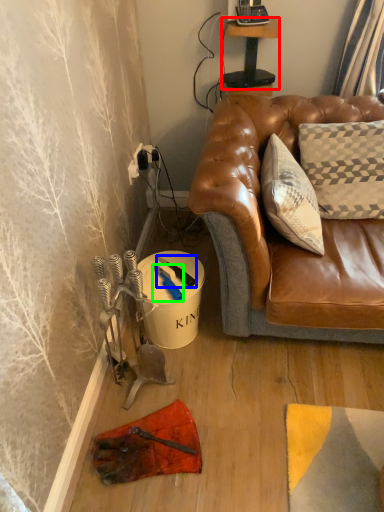
Question: Which object is positioned closest to table (highlighted by a red box)? Select from tool (highlighted by a blue box) and tool (highlighted by a green box).

Choices:
 (A) tool
 (B) tool

Answer: (A)